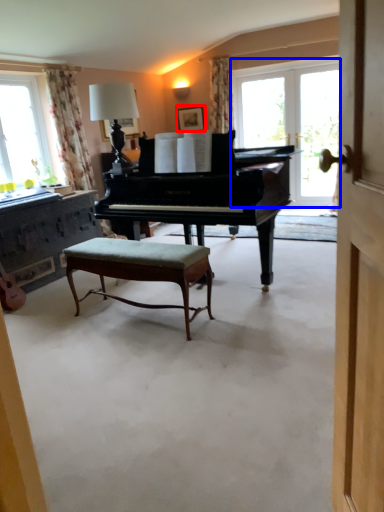
Question: Which object appears closest to the camera in this image, picture frame (highlighted by a red box) or window screen (highlighted by a blue box)?

Choices:
 (A) picture frame
 (B) window screen

Answer: (B)